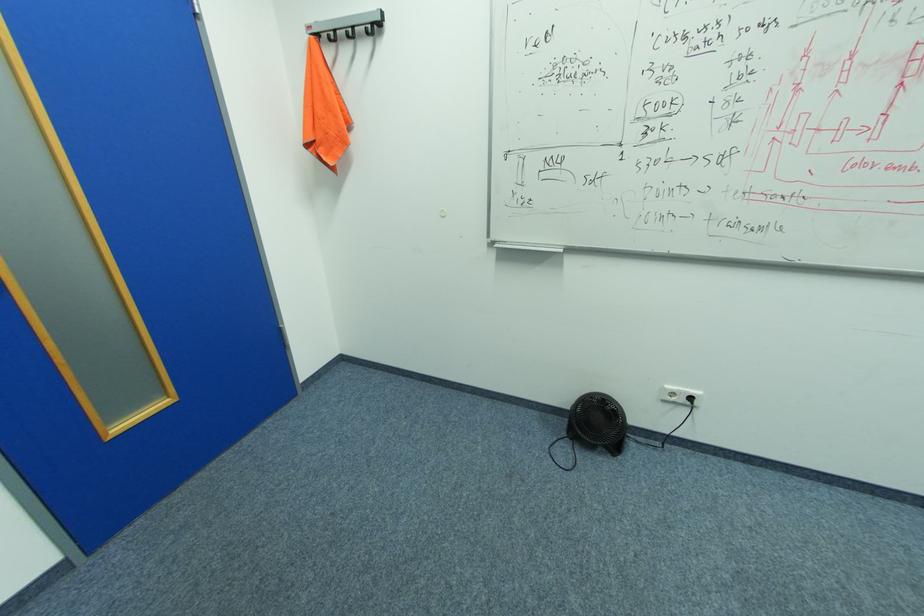
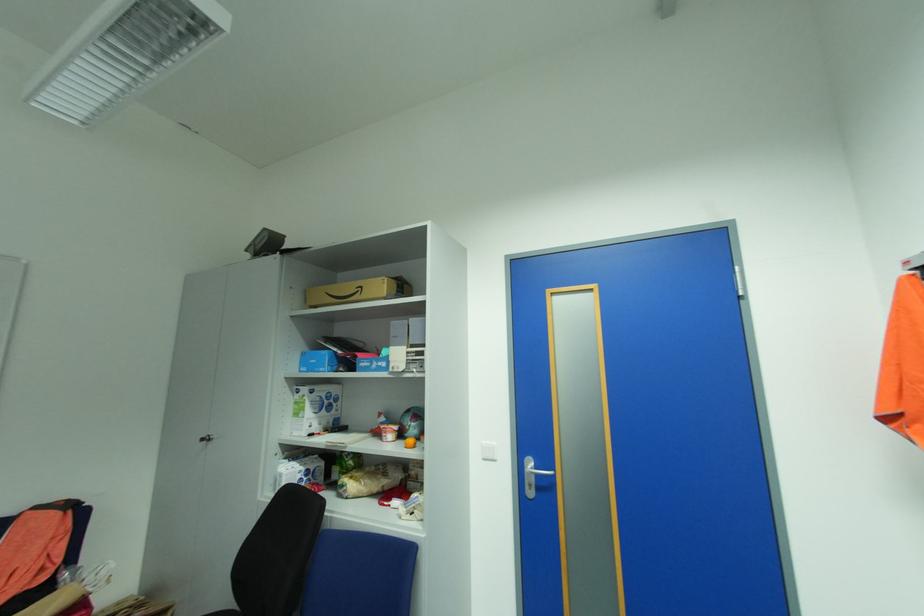
Question: The camera is either moving clockwise (left) or counter-clockwise (right) around the object. The first image is from the beginning of the video and the second image is from the end. Is the camera moving left or right when shooting the video?

Choices:
 (A) Left
 (B) Right

Answer: (B)